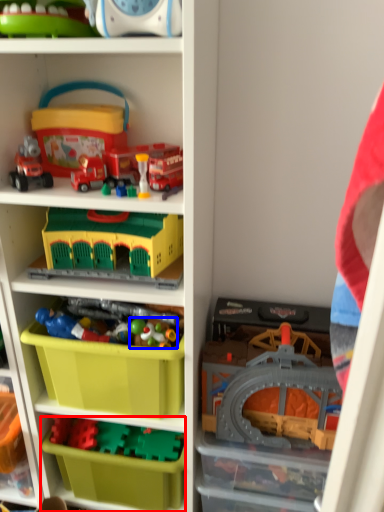
Question: Which object appears farthest to the camera in this image, storage box (highlighted by a red box) or toy (highlighted by a blue box)?

Choices:
 (A) storage box
 (B) toy

Answer: (A)